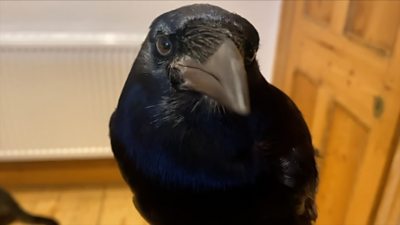
Find the location of a particular element. This screenshot has height=225, width=400. wooden door is located at coordinates (343, 53).